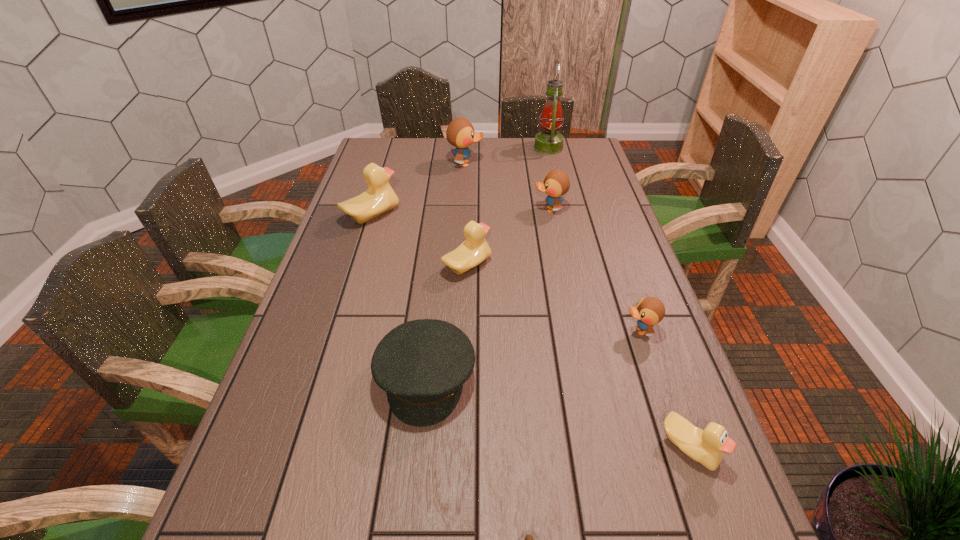
Locate which blue duck is the closest to the beret. Please provide its 2D coordinates. Your answer should be formatted as a tuple, i.e. [(x, y)], where the tuple contains the x and y coordinates of a point satisfying the conditions above.

[(649, 311)]

Identify which beige duck is the second closest to the fifth object from left to right. Please provide its 2D coordinates. Your answer should be formatted as a tuple, i.e. [(x, y)], where the tuple contains the x and y coordinates of a point satisfying the conditions above.

[(474, 250)]

You are a GUI agent. You are given a task and a screenshot of the screen. Output one action in this format:
    pyautogui.click(x=<x>, y=<y>)
    Task: Click on the beige duck that stands as the second closest to the second farthest beige duck
    
    Given the screenshot: What is the action you would take?
    pyautogui.click(x=708, y=447)

At what (x,y) coordinates should I click in order to perform the action: click on free location that satisfies the following two spatial constraints: 1. at the beak of the second smallest beige duck; 2. on the front-facing side of the beret. Please return your answer as a coordinate pair (x, y). Looking at the image, I should click on (464, 379).